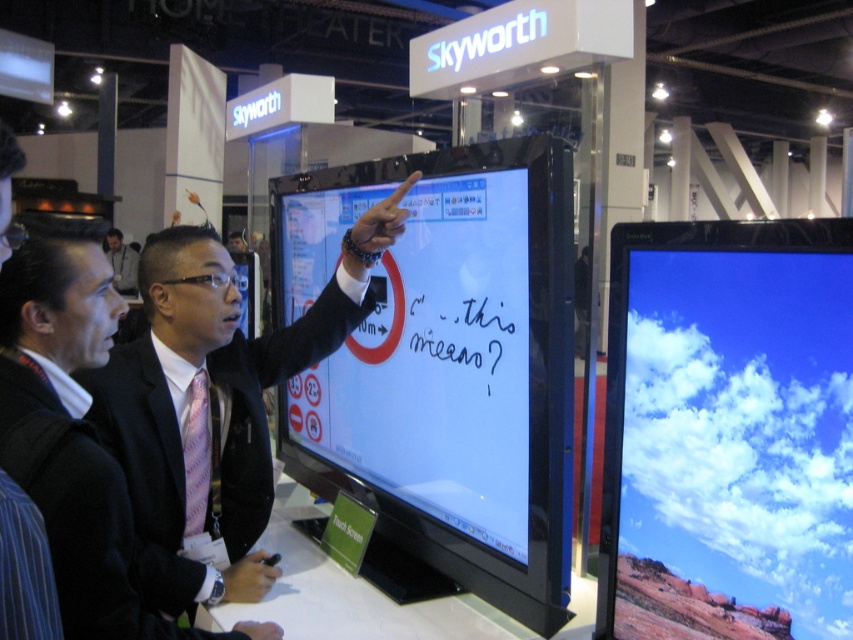
You are standing in the Skyworth booth at the exhibition. You want to locate the matte black touch screen at center. Where should you look?

You should look at point (438, 364) to locate the matte black touch screen at center.

You are an attendee at the trade show and want to take a photo of both the matte glass monitor at right and the matte black touch screen at center. Which one should you focus on first if you want to capture both in a single frame without moving your camera?

You should focus on the matte black touch screen at center first because the matte glass monitor at right is positioned on the right side of it, so keeping the matte black touch screen at center centered will ensure both are in frame.